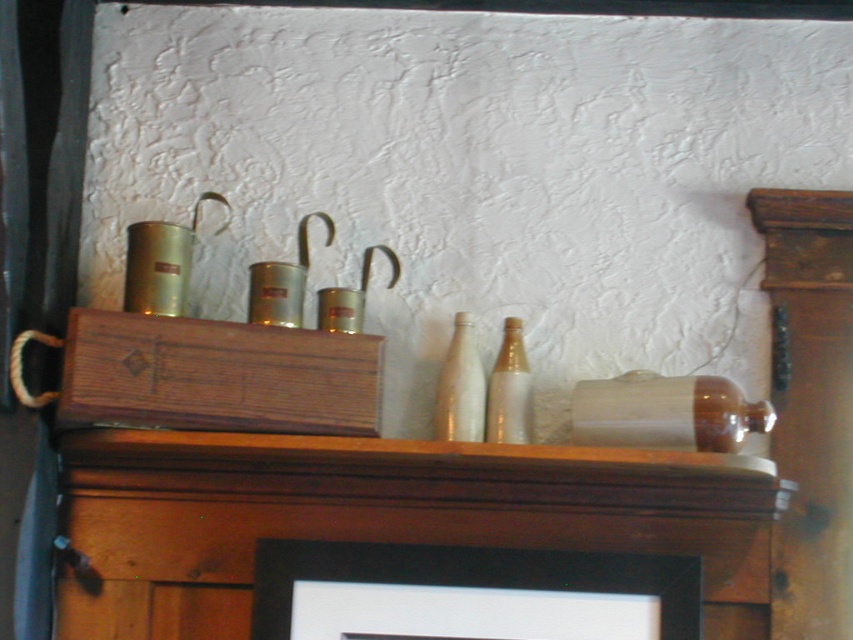
You are standing in front of the wooden cabinet and want to place a new item between the two points labeled point (426,611) and point (721,438). Based on their positions, which point is closer to you, and where should you place the new item to ensure it is between them?

Point (721,438) is closer to you since it is in front of point (426,611). To place the new item between them, position it closer to point (721,438) but still behind it, maintaining the spatial order.

You are standing in front of a wooden cabinet with items arranged on it. You need to place a small decorative item on the shelf. Which object, the wooden at center or the white glass bottle at center, is better to place it in front of to ensure it is visible?

The wooden at center is closer to the viewer than the white glass bottle at center, so placing the decorative item in front of the wooden at center would make it more visible since it is already closer.

You are organizing items on a shelf and need to place a new item between the wooden at center and the white glass bottle at center. Based on their positions, where should you place the new item?

The wooden at center is below the white glass bottle at center, so placing the new item between them would require positioning it above the wooden at center and below the white glass bottle at center.